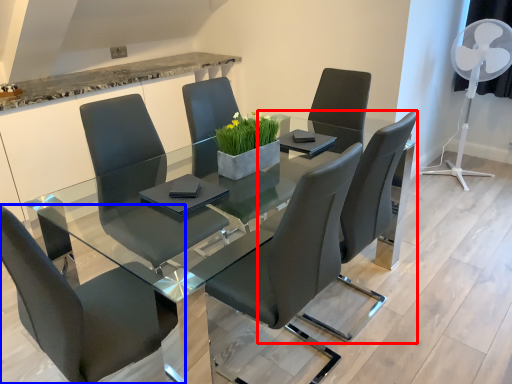
Question: Among these objects, which one is nearest to the camera, chair (highlighted by a red box) or chair (highlighted by a blue box)?

Choices:
 (A) chair
 (B) chair

Answer: (B)